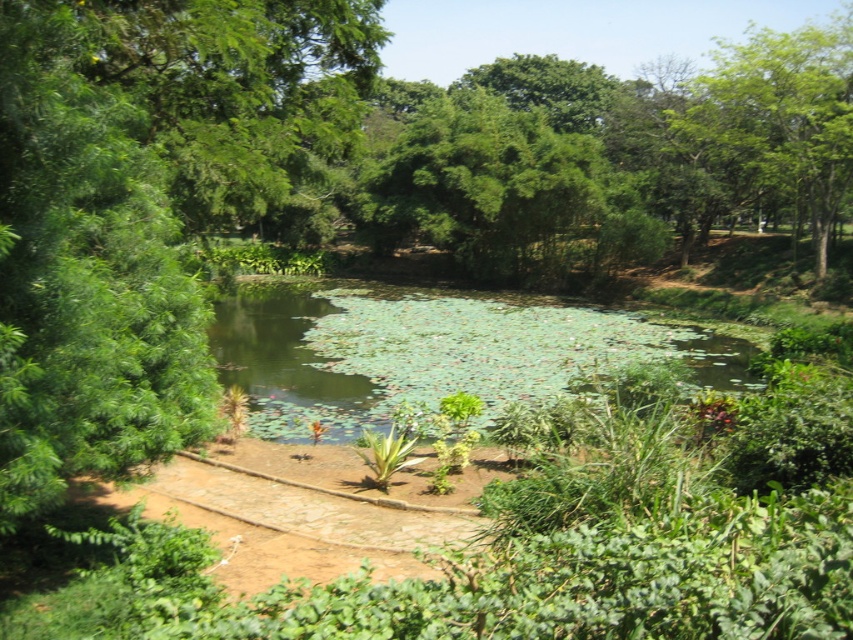
Question: Can you confirm if green leafy water at center is positioned above green leafy tree at upper right?

Choices:
 (A) no
 (B) yes

Answer: (A)

Question: Does green leafy water at center have a smaller size compared to green leafy tree at upper right?

Choices:
 (A) no
 (B) yes

Answer: (B)

Question: Among these objects, which one is nearest to the camera?

Choices:
 (A) green leafy tree at upper right
 (B) green leafy water at center

Answer: (B)

Question: Which point is closer to the camera?

Choices:
 (A) green leafy water at center
 (B) green leafy tree at upper right

Answer: (A)

Question: Does green leafy water at center come behind green leafy tree at upper right?

Choices:
 (A) no
 (B) yes

Answer: (A)

Question: Which point appears closest to the camera in this image?

Choices:
 (A) (749, 58)
 (B) (374, 352)

Answer: (B)